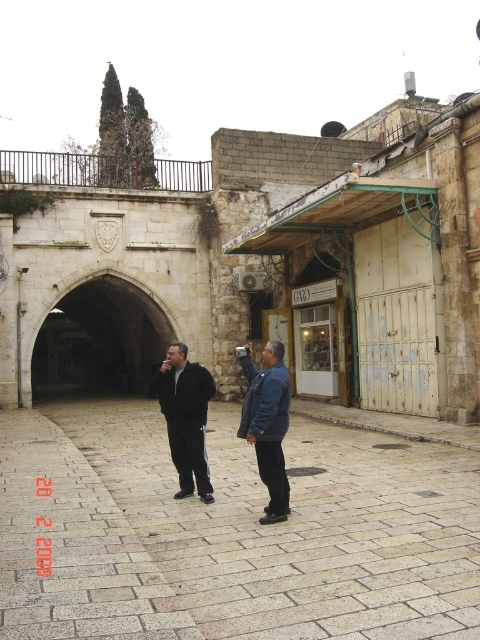
Identify the location of smooth stone alley at center. The image size is (480, 640). (232, 532).

Is smooth stone alley at center bigger than black matte jacket at center?

Yes.

The width and height of the screenshot is (480, 640). Describe the element at coordinates (232, 532) in the screenshot. I see `smooth stone alley at center` at that location.

What are the coordinates of `smooth stone alley at center` in the screenshot? It's located at (232, 532).

Is smooth stone alley at center smaller than blue denim jacket at center?

Correct, smooth stone alley at center occupies less space than blue denim jacket at center.

Between smooth stone alley at center and blue denim jacket at center, which one is positioned higher?

blue denim jacket at center is higher up.

Who is more distant from viewer, (162, 609) or (267, 369)?

The point (267, 369) is behind.

Locate an element on the screen. This screenshot has height=640, width=480. smooth stone alley at center is located at coordinates (232, 532).

Does black matte jacket at center have a greater height compared to blue denim jacket at center?

Incorrect, black matte jacket at center's height is not larger of blue denim jacket at center's.

This screenshot has width=480, height=640. In order to click on black matte jacket at center in this screenshot , I will do `click(186, 417)`.